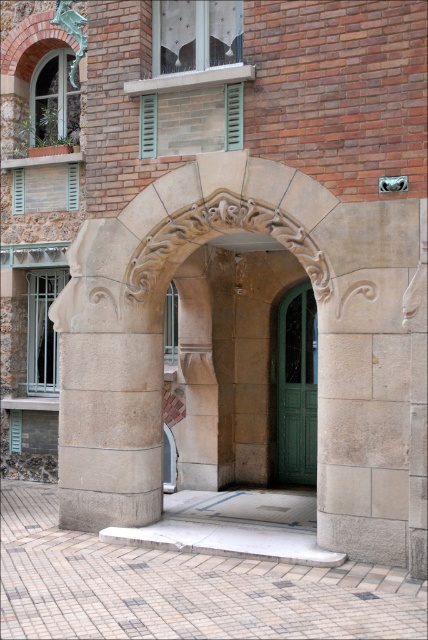
Consider the image. Is green matte door at center smaller than white plastic shutter at upper left?

Incorrect, green matte door at center is not smaller in size than white plastic shutter at upper left.

Between green matte door at center and white plastic shutter at upper left, which one has less height?

With less height is white plastic shutter at upper left.

Who is more distant from viewer, (281,371) or (17,188)?

The point (17,188) is behind.

Where is `green matte door at center`? green matte door at center is located at coordinates (297, 387).

Can you confirm if green matte door at center is positioned to the right of green painted wood at upper center?

Yes, green matte door at center is to the right of green painted wood at upper center.

Who is shorter, green matte door at center or green painted wood at upper center?

green painted wood at upper center

Between point (285, 429) and point (151, 109), which one is positioned behind?

The point (285, 429) is behind.

Find the location of `green matte door at center`. green matte door at center is located at coordinates click(297, 387).

Is the position of white plastic shutter at upper left more distant than that of green patina metal statue at upper left?

Yes, white plastic shutter at upper left is further from the viewer.

Between point (62, 177) and point (74, 61), which one is positioned behind?

The point (62, 177) is more distant.

Identify the location of white plastic shutter at upper left. 45,188.